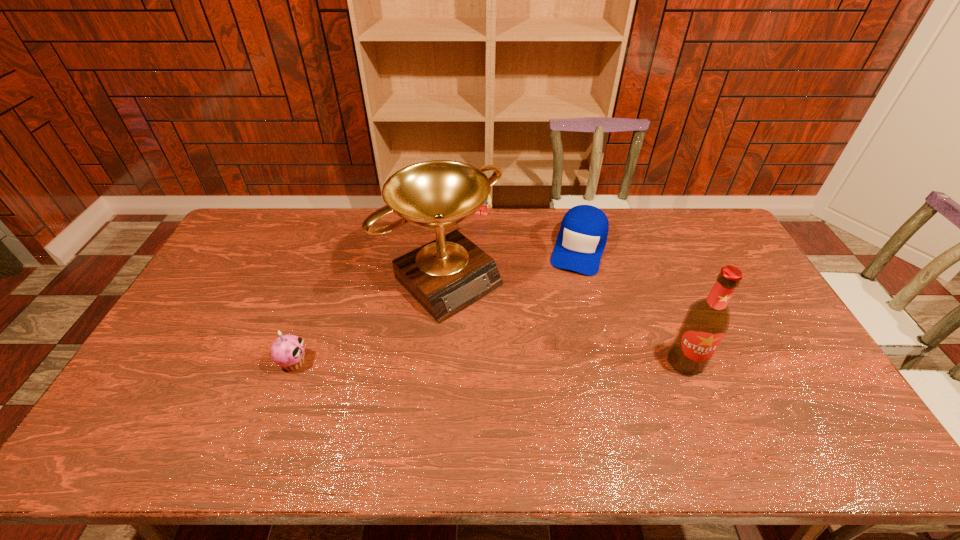
The image size is (960, 540). I want to click on the leftmost object, so click(x=287, y=351).

Identify the location of beer bottle. (707, 320).

Where is `award`? award is located at coordinates (449, 274).

Identify the location of baseball cap. (582, 238).

The image size is (960, 540). What are the coordinates of `the farthest object` in the screenshot? It's located at (483, 210).

Locate an element on the screen. This screenshot has width=960, height=540. free region located 0.220m on the face of the cupcake is located at coordinates (388, 362).

This screenshot has width=960, height=540. Find the location of `vacant space located on the back of the beer bottle`. vacant space located on the back of the beer bottle is located at coordinates (664, 310).

Locate an element on the screen. vacant space located on the front-facing side of the award is located at coordinates (564, 389).

Find the location of `free space located on the front-facing side of the award`. free space located on the front-facing side of the award is located at coordinates (566, 392).

Locate an element on the screen. Image resolution: width=960 pixels, height=540 pixels. vacant space located on the front-facing side of the award is located at coordinates (578, 402).